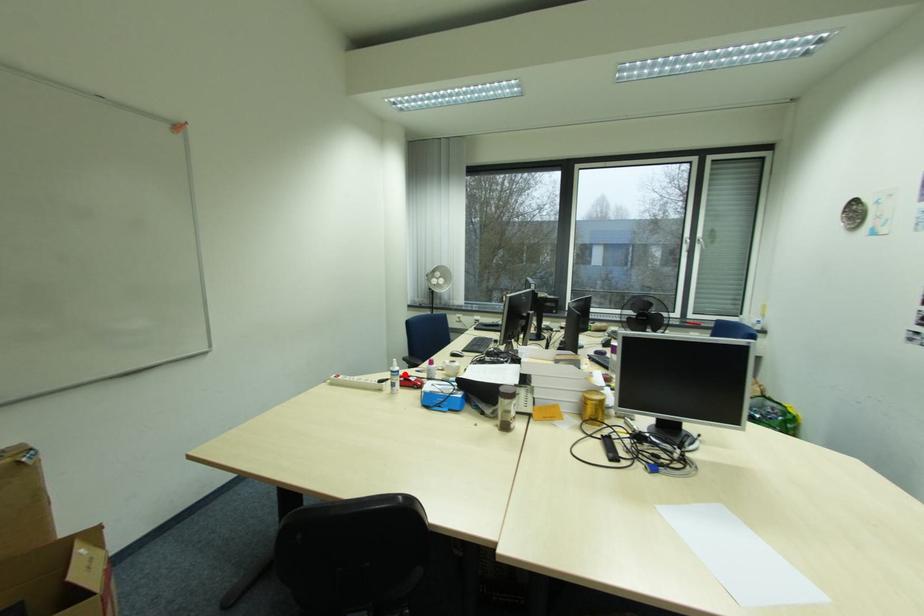
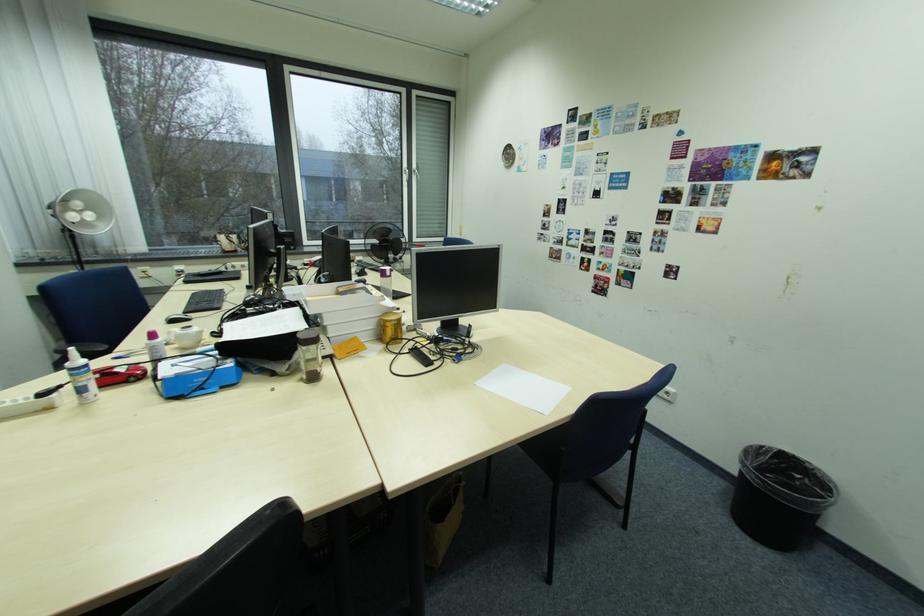
Question: I am providing you with two images of the same scene from different viewpoints. Given a red point in image1, look at the same physical point in image2. Is it:

Choices:
 (A) Closer to the viewpoint
 (B) Farther from the viewpoint

Answer: (B)